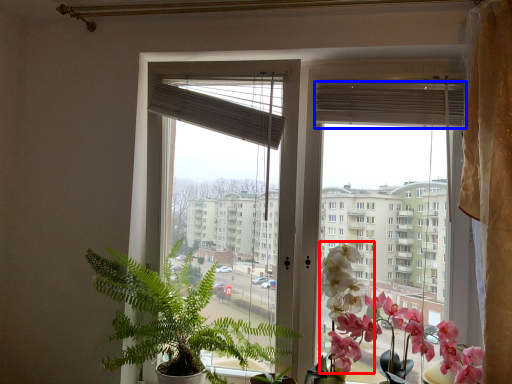
Question: Which object appears farthest to the camera in this image, flower (highlighted by a red box) or blind (highlighted by a blue box)?

Choices:
 (A) flower
 (B) blind

Answer: (B)